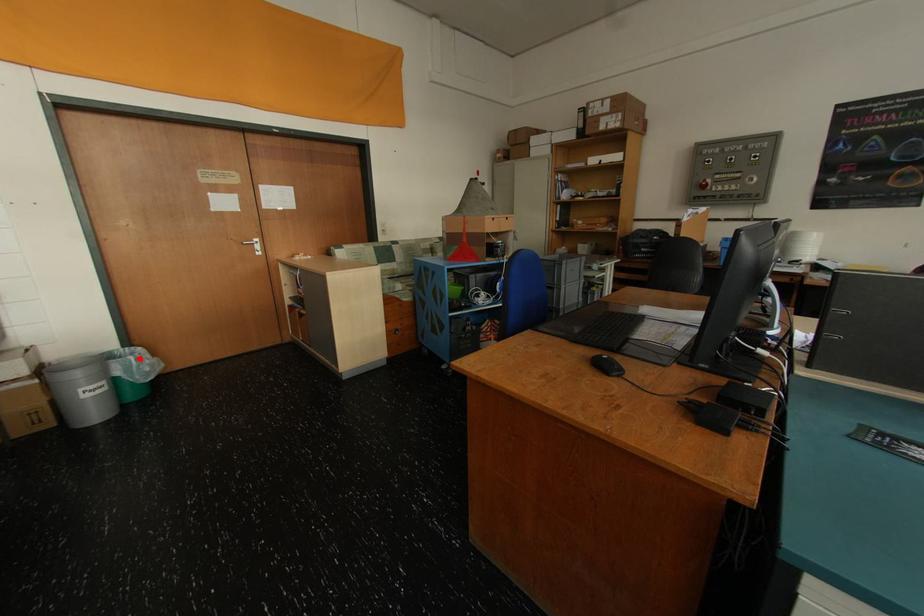
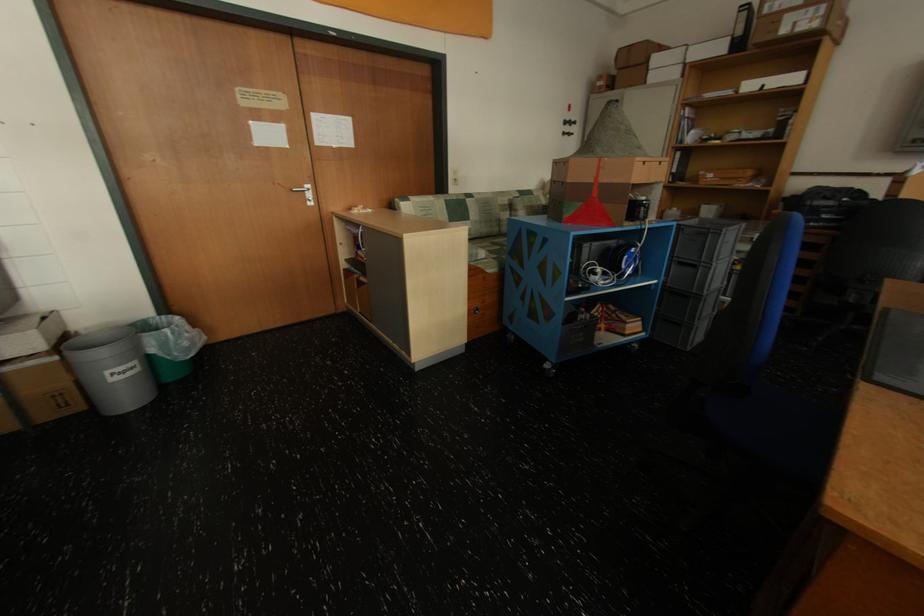
Locate, in the second image, the point that corresponds to the highlighted location in the first image.

(176, 331)